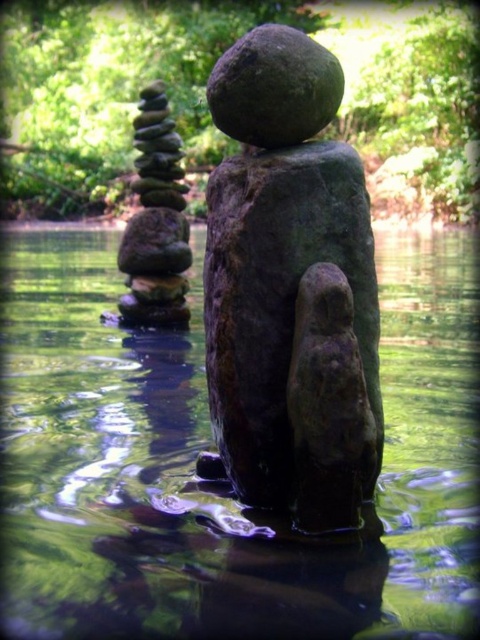
Who is lower down, rough stone statue at center or smooth gray stones at left?

rough stone statue at center is below.

Identify the location of rough stone statue at center. (290, 288).

Does point (457, 484) lie in front of point (245, 49)?

No.

Describe the element at coordinates (205, 449) in the screenshot. I see `green reflective water at center` at that location.

Where is `green reflective water at center`? The height and width of the screenshot is (640, 480). green reflective water at center is located at coordinates (205, 449).

Who is shorter, green reflective water at center or rough stone statue at center?

rough stone statue at center is shorter.

Is green reflective water at center thinner than rough stone statue at center?

No.

This screenshot has height=640, width=480. I want to click on green reflective water at center, so click(x=205, y=449).